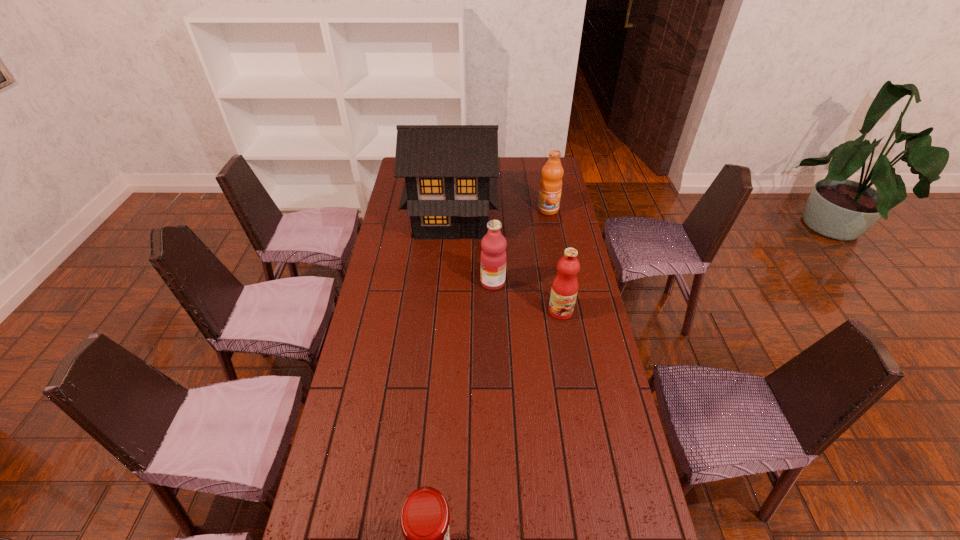
This screenshot has height=540, width=960. Find the location of `vacant area situated on the label of the third nearest object`. vacant area situated on the label of the third nearest object is located at coordinates (396, 282).

Locate an element on the screen. object that is at the left edge is located at coordinates (451, 171).

Locate an element on the screen. free region at the left edge of the desktop is located at coordinates (399, 334).

Find the location of `vacant space at the right edge`. vacant space at the right edge is located at coordinates (570, 421).

In the image, there is a desktop. At what (x,y) coordinates should I click in order to perform the action: click on vacant space at the far right corner. Please return your answer as a coordinate pair (x, y). The height and width of the screenshot is (540, 960). Looking at the image, I should click on (530, 169).

In order to click on vacant region between the dollhouse and the farthest fruit juice in this screenshot , I will do `click(500, 213)`.

This screenshot has height=540, width=960. In order to click on unoccupied area between the second nearest fruit juice and the second nearest object in this screenshot , I will do `click(527, 297)`.

Identify the location of vacant space that is in between the third farthest object and the dollhouse. The image size is (960, 540). (472, 249).

Find the location of `free point between the fourth farthest object and the tallest object`. free point between the fourth farthest object and the tallest object is located at coordinates (507, 264).

Locate an element on the screen. vacant region between the nearest fruit juice and the second farthest fruit juice is located at coordinates (527, 297).